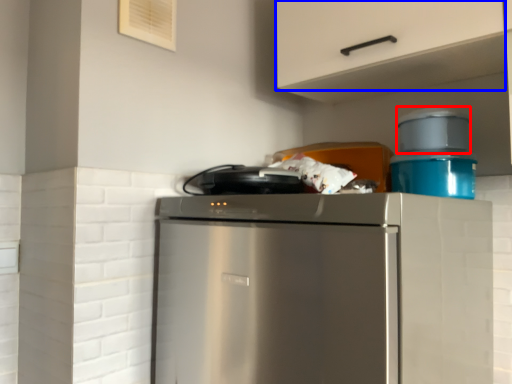
Question: Which of the following is the farthest to the observer, appliance (highlighted by a red box) or cabinetry (highlighted by a blue box)?

Choices:
 (A) appliance
 (B) cabinetry

Answer: (A)